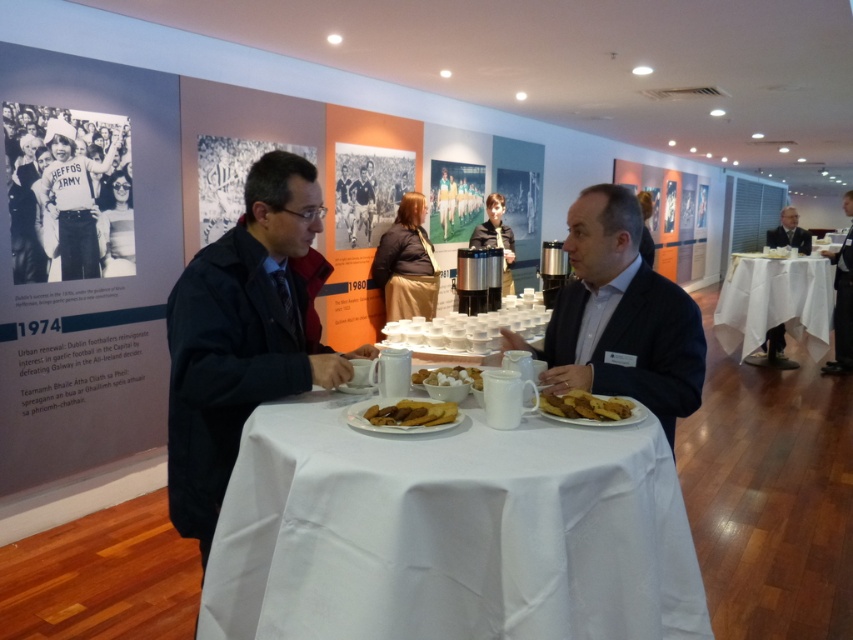
Question: Which point appears closest to the camera in this image?

Choices:
 (A) (845, 195)
 (B) (421, 230)

Answer: (B)

Question: Does dark blue jacket at center lie behind brown fabric jacket at center?

Choices:
 (A) no
 (B) yes

Answer: (A)

Question: Which of these objects is positioned closest to the white matte plate at center?

Choices:
 (A) white sugar cubes at center
 (B) dark blue suit at right
 (C) dark suit at right

Answer: (C)

Question: Which of the following is the closest to the observer?

Choices:
 (A) white cloth table at right
 (B) dark suit at right

Answer: (A)

Question: From the image, what is the correct spatial relationship of dark suit at right in relation to golden brown crispy pastry at center?

Choices:
 (A) right
 (B) left

Answer: (A)

Question: Does white fabric shirt at upper left appear on the right side of golden brown crispy pastry at center?

Choices:
 (A) no
 (B) yes

Answer: (A)